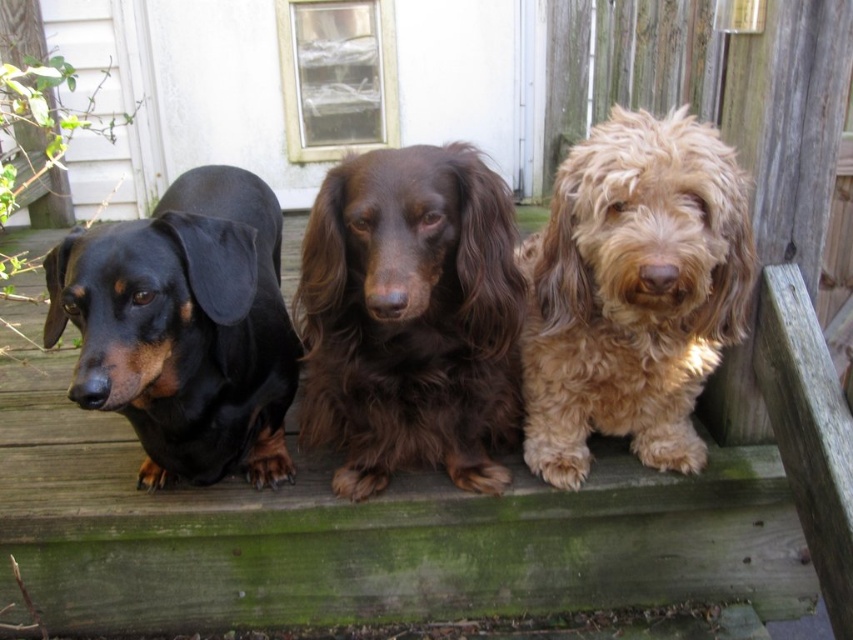
The height and width of the screenshot is (640, 853). What do you see at coordinates (631, 292) in the screenshot?
I see `fuzzy golden dog at center` at bounding box center [631, 292].

Does fuzzy golden dog at center have a smaller size compared to black shiny coat at left?

Yes.

Which is in front, point (717, 314) or point (102, 372)?

Point (102, 372) is in front.

Image resolution: width=853 pixels, height=640 pixels. I want to click on fuzzy golden dog at center, so click(x=631, y=292).

Is point (495, 362) closer to camera compared to point (694, 470)?

Yes, point (495, 362) is in front of point (694, 470).

You are a GUI agent. You are given a task and a screenshot of the screen. Output one action in this format:
    pyautogui.click(x=<x>, y=<y>)
    Task: Click on the brown shaggy dog at center
    This screenshot has height=640, width=853.
    Given the screenshot: What is the action you would take?
    pyautogui.click(x=410, y=317)

Is brown shaggy dog at center smaller than black shiny coat at left?

Yes.

Does brown shaggy dog at center appear on the right side of black shiny coat at left?

Yes, brown shaggy dog at center is to the right of black shiny coat at left.

Does point (486, 221) come behind point (212, 344)?

No, it is in front of (212, 344).

Where is `brown shaggy dog at center`? Image resolution: width=853 pixels, height=640 pixels. brown shaggy dog at center is located at coordinates (410, 317).